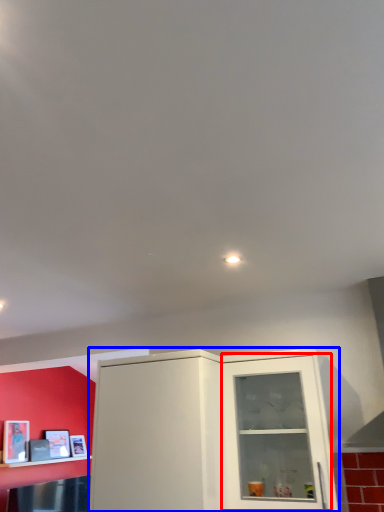
Question: Which object is closer to the camera taking this photo, glass door (highlighted by a red box) or cabinetry (highlighted by a blue box)?

Choices:
 (A) glass door
 (B) cabinetry

Answer: (B)